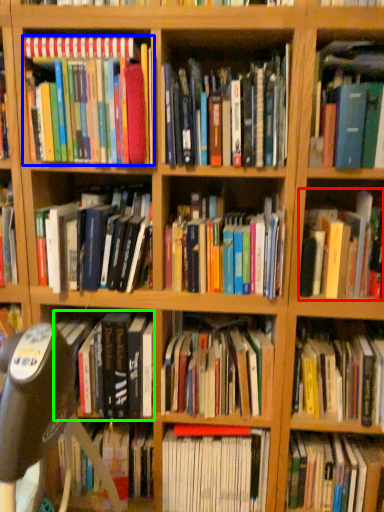
Question: Which is farther away from book (highlighted by a red box)? book (highlighted by a blue box) or book (highlighted by a green box)?

Choices:
 (A) book
 (B) book

Answer: (A)